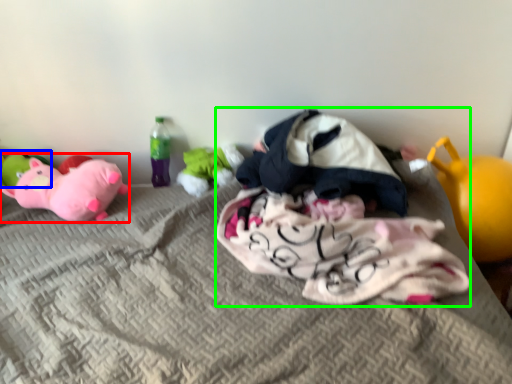
Question: Which is farther away from toy (highlighted by a red box)? toy (highlighted by a blue box) or laundry (highlighted by a green box)?

Choices:
 (A) toy
 (B) laundry

Answer: (B)